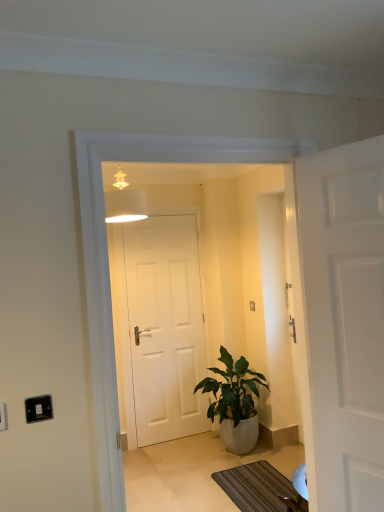
Where is `vacant area situated below matte white lampshade at upper center (from a real-world perspective)`? The height and width of the screenshot is (512, 384). vacant area situated below matte white lampshade at upper center (from a real-world perspective) is located at coordinates (148, 506).